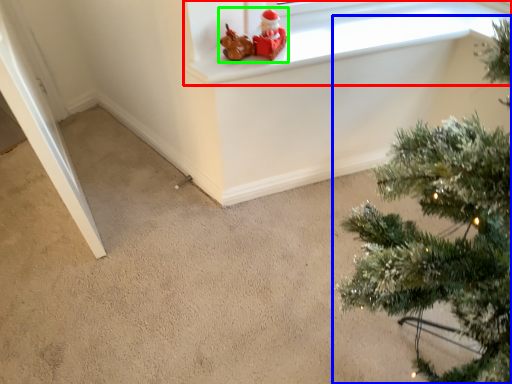
Question: Considering the real-world distances, which object is farthest from window frame (highlighted by a red box)? christmas tree (highlighted by a blue box) or toy (highlighted by a green box)?

Choices:
 (A) christmas tree
 (B) toy

Answer: (A)